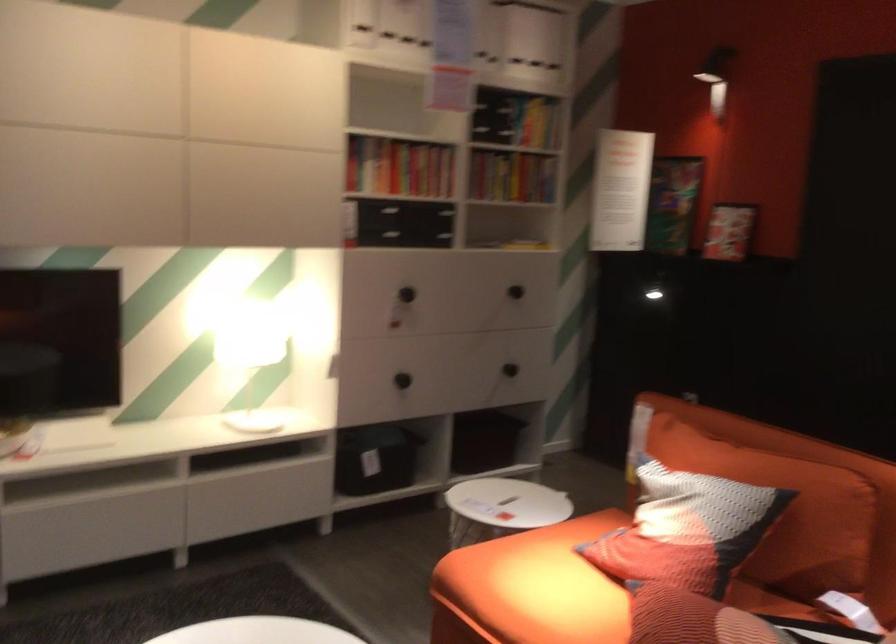
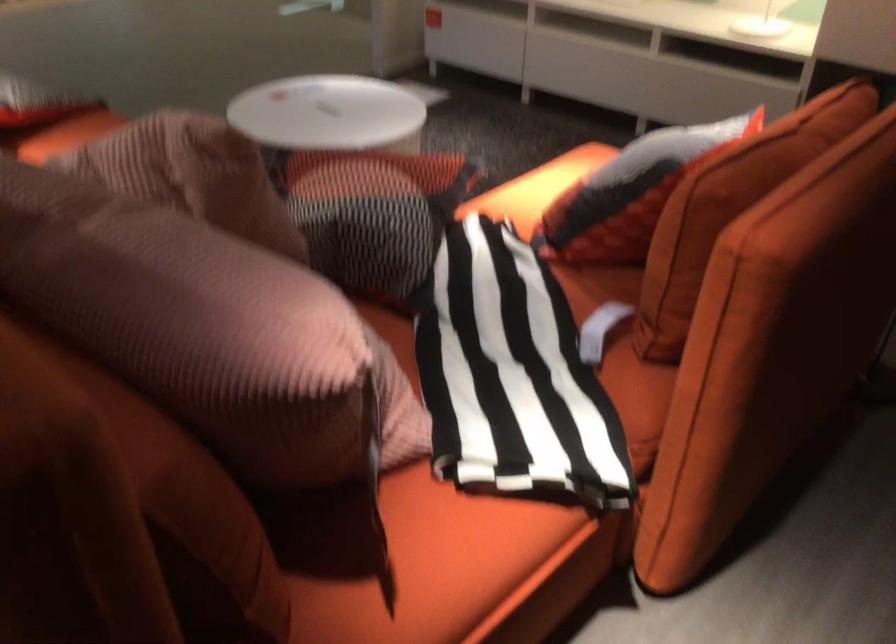
Question: I am providing you with two images of the same scene from different viewpoints. Please identify which objects are invisible in image2.

Choices:
 (A) sofa sitting surface
 (B) pink ribbed pillow
 (C) ladder handle rail
 (D) sofa armrest

Answer: (A)